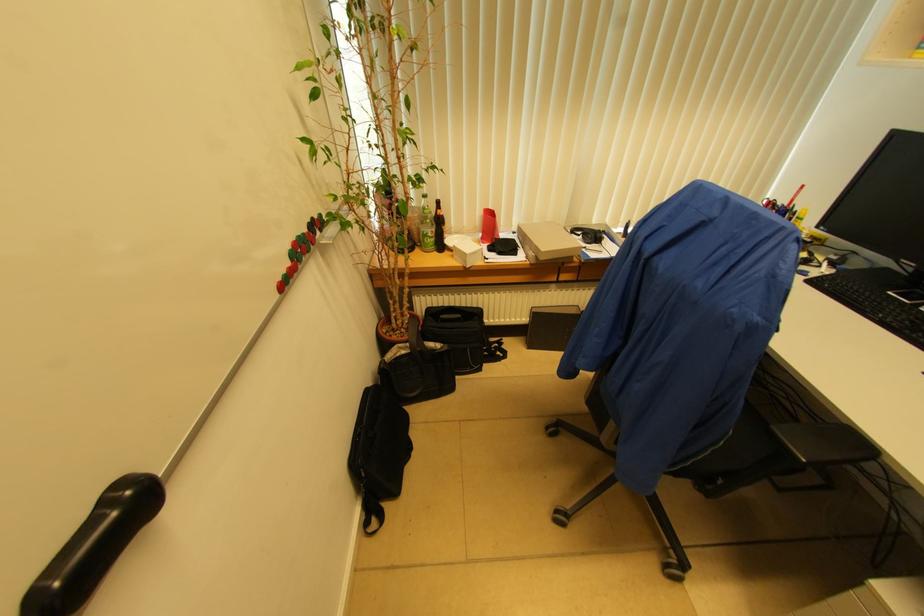
What are the coordinates of `black bag handle` in the screenshot? It's located at (492, 350).